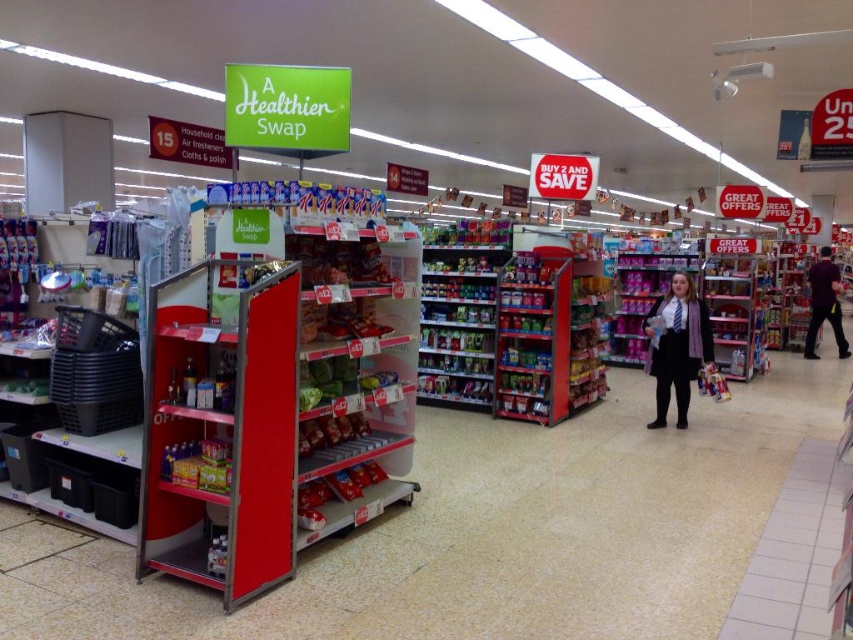
Which is more to the left, metallic red shelf at center or purple fabric shirt at right?

metallic red shelf at center is more to the left.

Does metallic red shelf at center appear over purple fabric shirt at right?

No, metallic red shelf at center is not above purple fabric shirt at right.

This screenshot has height=640, width=853. What are the coordinates of `metallic red shelf at center` in the screenshot? It's located at (221, 429).

Is matte black blazer at center positioned in front of purple fabric shirt at right?

Yes, matte black blazer at center is closer to the viewer.

Between matte black blazer at center and purple fabric shirt at right, which one is positioned higher?

purple fabric shirt at right is higher up.

Is point (688, 339) closer to camera compared to point (821, 248)?

Yes, point (688, 339) is closer to viewer.

Locate an element on the screen. matte black blazer at center is located at coordinates (676, 346).

Based on the photo, between red plastic shelf at center and matte black blazer at center, which one appears on the right side from the viewer's perspective?

matte black blazer at center is more to the right.

Who is more forward, (450, 490) or (677, 371)?

Point (450, 490) is in front.

This screenshot has width=853, height=640. Find the location of `red plastic shelf at center`. red plastic shelf at center is located at coordinates (523, 534).